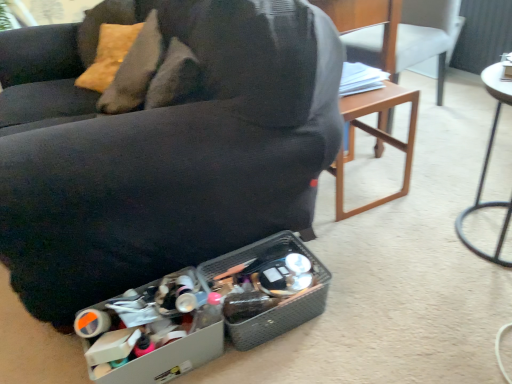
How much space does wooden chair at right, which is counted as the second chair, starting from the left, occupy horizontally?

24.58 inches.

What is the approximate height of metallic silver table at right?

57.34 centimeters.

This screenshot has width=512, height=384. Describe the element at coordinates (487, 167) in the screenshot. I see `metallic silver table at right` at that location.

Locate an element on the screen. wooden chair at right, which is counted as the second chair, starting from the left is located at coordinates pyautogui.click(x=408, y=39).

Based on the photo, which object is thinner, matte black couch at center, placed as the 2th chair when sorted from right to left, or wooden chair at right, which is counted as the second chair, starting from the left?

wooden chair at right, which is counted as the second chair, starting from the left.

Which object is positioned more to the left, matte black couch at center, placed as the 2th chair when sorted from right to left, or wooden chair at right, which is counted as the second chair, starting from the left?

matte black couch at center, placed as the 2th chair when sorted from right to left.

Is point (271, 159) closer or farther from the camera than point (408, 33)?

Point (271, 159) is closer to the camera than point (408, 33).

Between matte black couch at center, placed as the 2th chair when sorted from right to left, and wooden chair at right, which is counted as the second chair, starting from the left, which one is positioned in front?

Positioned in front is matte black couch at center, placed as the 2th chair when sorted from right to left.

Locate an element on the screen. The image size is (512, 384). table below the wooden chair at right, positioned as the first chair in right-to-left order (from a real-world perspective) is located at coordinates (487, 167).

Can you confirm if metallic silver table at right is shorter than wooden chair at right, positioned as the first chair in right-to-left order?

Yes.

Does metallic silver table at right touch wooden chair at right, which is counted as the second chair, starting from the left?

No, metallic silver table at right is not touching wooden chair at right, which is counted as the second chair, starting from the left.

Is metallic silver table at right oriented away from wooden chair at right, positioned as the first chair in right-to-left order?

No.

From the image's perspective, is wooden chair at right, which is counted as the second chair, starting from the left, above or below metallic silver table at right?

From the image's perspective, wooden chair at right, which is counted as the second chair, starting from the left, appears above metallic silver table at right.

How different are the orientations of wooden chair at right, which is counted as the second chair, starting from the left, and metallic silver table at right in degrees?

wooden chair at right, which is counted as the second chair, starting from the left, and metallic silver table at right are facing 12.2 degrees away from each other.

Based on their sizes in the image, would you say wooden chair at right, which is counted as the second chair, starting from the left, is bigger or smaller than metallic silver table at right?

In the image, wooden chair at right, which is counted as the second chair, starting from the left, appears to be larger than metallic silver table at right.

In terms of width, does metallic silver table at right look wider or thinner when compared to matte black couch at center, placed as the first chair when sorted from left to right?

In the image, metallic silver table at right appears to be more narrow than matte black couch at center, placed as the first chair when sorted from left to right.

How many degrees apart are the facing directions of metallic silver table at right and matte black couch at center, placed as the first chair when sorted from left to right?

The angular difference between metallic silver table at right and matte black couch at center, placed as the first chair when sorted from left to right, is 2.56 degrees.

Is metallic silver table at right oriented away from matte black couch at center, placed as the 2th chair when sorted from right to left?

No.

Is metallic silver table at right inside or outside of matte black couch at center, placed as the 2th chair when sorted from right to left?

metallic silver table at right exists outside the volume of matte black couch at center, placed as the 2th chair when sorted from right to left.

From the image's perspective, would you say wooden chair at right, positioned as the first chair in right-to-left order, is shown under matte black couch at center, placed as the first chair when sorted from left to right?

No.

Does wooden chair at right, positioned as the first chair in right-to-left order, have a greater width compared to matte black couch at center, placed as the first chair when sorted from left to right?

Incorrect, the width of wooden chair at right, positioned as the first chair in right-to-left order, does not surpass that of matte black couch at center, placed as the first chair when sorted from left to right.

Considering the points (394, 76) and (254, 23), which point is behind, point (394, 76) or point (254, 23)?

The point (394, 76) is farther.

Which is farther, (225,68) or (466,209)?

The point (466,209) is more distant.

In the image, is matte black couch at center, placed as the 2th chair when sorted from right to left, on the left side or the right side of metallic silver table at right?

matte black couch at center, placed as the 2th chair when sorted from right to left, is to the left of metallic silver table at right.

Find the location of a particular element. This screenshot has height=384, width=512. table on the right of the matte black couch at center, placed as the first chair when sorted from left to right is located at coordinates (487, 167).

How many degrees apart are the facing directions of matte black couch at center, placed as the 2th chair when sorted from right to left, and metallic silver table at right?

The facing directions of matte black couch at center, placed as the 2th chair when sorted from right to left, and metallic silver table at right are 2.56 degrees apart.

The width and height of the screenshot is (512, 384). I want to click on chair on the left of wooden chair at right, positioned as the first chair in right-to-left order, so click(x=164, y=149).

I want to click on chair behind the metallic silver table at right, so click(408, 39).

Looking at the image, which one is located further to wooden chair at right, which is counted as the second chair, starting from the left, metallic silver table at right or matte black couch at center, placed as the first chair when sorted from left to right?

Among the two, matte black couch at center, placed as the first chair when sorted from left to right, is located further to wooden chair at right, which is counted as the second chair, starting from the left.

From the image, which object appears to be farther from matte black couch at center, placed as the first chair when sorted from left to right, metallic silver table at right or wooden chair at right, which is counted as the second chair, starting from the left?

wooden chair at right, which is counted as the second chair, starting from the left, lies further to matte black couch at center, placed as the first chair when sorted from left to right, than the other object.

Considering their positions, is wooden chair at right, positioned as the first chair in right-to-left order, positioned closer to metallic silver table at right than matte black couch at center, placed as the 2th chair when sorted from right to left?

wooden chair at right, positioned as the first chair in right-to-left order, is positioned closer to the anchor metallic silver table at right.

From the image, which object appears to be nearer to metallic silver table at right, matte black couch at center, placed as the first chair when sorted from left to right, or wooden chair at right, which is counted as the second chair, starting from the left?

Among the two, wooden chair at right, which is counted as the second chair, starting from the left, is located nearer to metallic silver table at right.

Looking at the image, which one is located closer to wooden chair at right, which is counted as the second chair, starting from the left, matte black couch at center, placed as the first chair when sorted from left to right, or metallic silver table at right?

Based on the image, metallic silver table at right appears to be nearer to wooden chair at right, which is counted as the second chair, starting from the left.

Estimate the real-world distances between objects in this image. Which object is further from matte black couch at center, placed as the first chair when sorted from left to right, wooden chair at right, which is counted as the second chair, starting from the left, or metallic silver table at right?

Among the two, wooden chair at right, which is counted as the second chair, starting from the left, is located further to matte black couch at center, placed as the first chair when sorted from left to right.

Identify the location of chair located between matte black couch at center, placed as the first chair when sorted from left to right, and metallic silver table at right in the left-right direction. Image resolution: width=512 pixels, height=384 pixels. (408, 39).